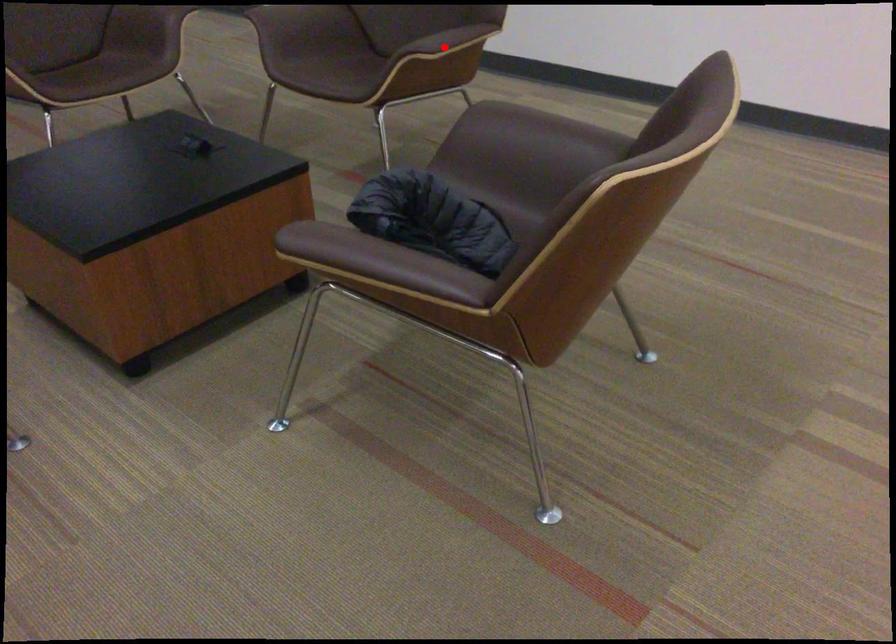
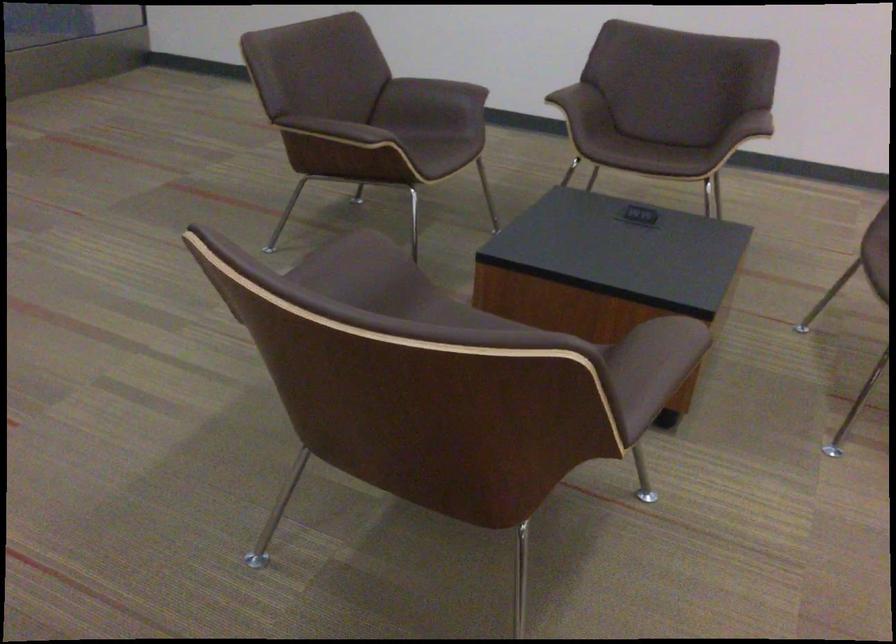
Question: I am providing you with two images of the same scene from different viewpoints. A red point is marked on the first image. At the location where the point appears in image 1, is it still visible in image 2?

Choices:
 (A) Yes
 (B) No

Answer: (B)